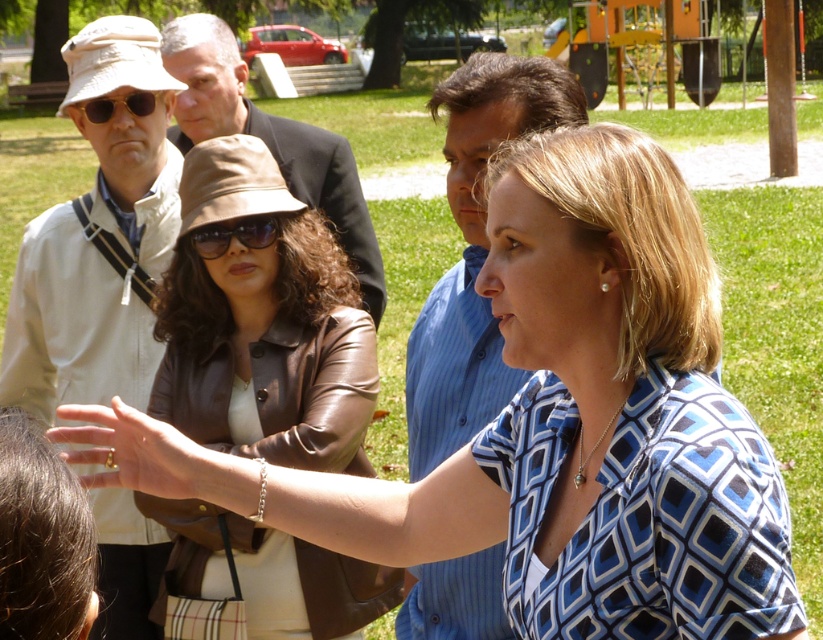
Consider the image. Does light beige fabric hat at upper left appear over matte black sunglasses at upper left?

Incorrect, light beige fabric hat at upper left is not positioned above matte black sunglasses at upper left.

Between light beige fabric hat at upper left and matte black sunglasses at upper left, which one appears on the left side from the viewer's perspective?

Positioned to the left is light beige fabric hat at upper left.

This screenshot has height=640, width=823. What do you see at coordinates (98, 237) in the screenshot? I see `light beige fabric hat at upper left` at bounding box center [98, 237].

Identify the location of light beige fabric hat at upper left. The image size is (823, 640). (98, 237).

Is point (329, 132) in front of point (101, 108)?

No, (329, 132) is behind (101, 108).

Is dark brown suit at center positioned in front of matte black sunglasses at upper left?

No, it is not.

Is point (194, 26) in front of point (86, 113)?

No, (194, 26) is behind (86, 113).

The image size is (823, 640). Identify the location of dark brown suit at center. (268, 140).

Which of these two, brown leather jacket at upper center or light beige fabric hat at upper left, stands taller?

brown leather jacket at upper center

Is brown leather jacket at upper center closer to camera compared to light beige fabric hat at upper left?

Yes, brown leather jacket at upper center is closer to the viewer.

The height and width of the screenshot is (640, 823). Identify the location of brown leather jacket at upper center. (263, 323).